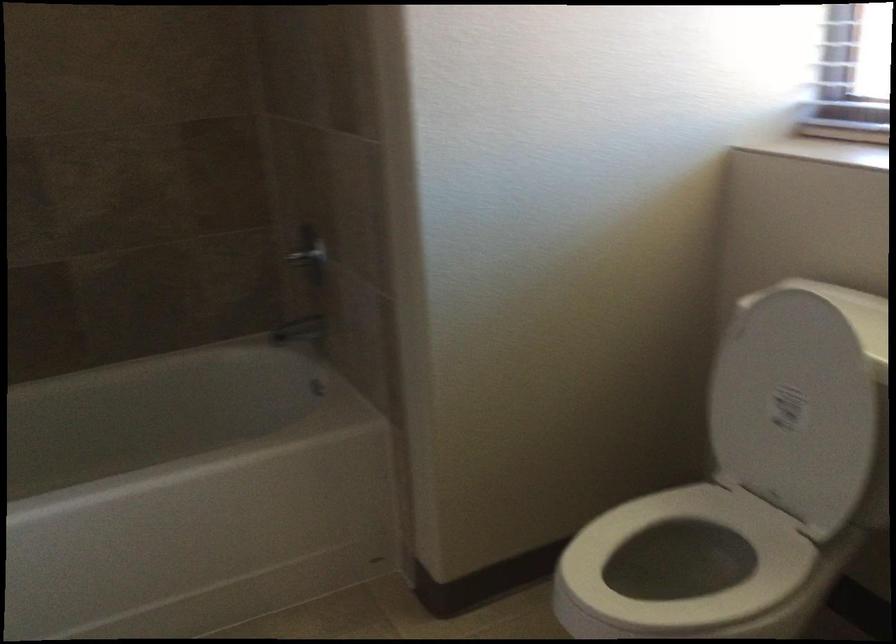
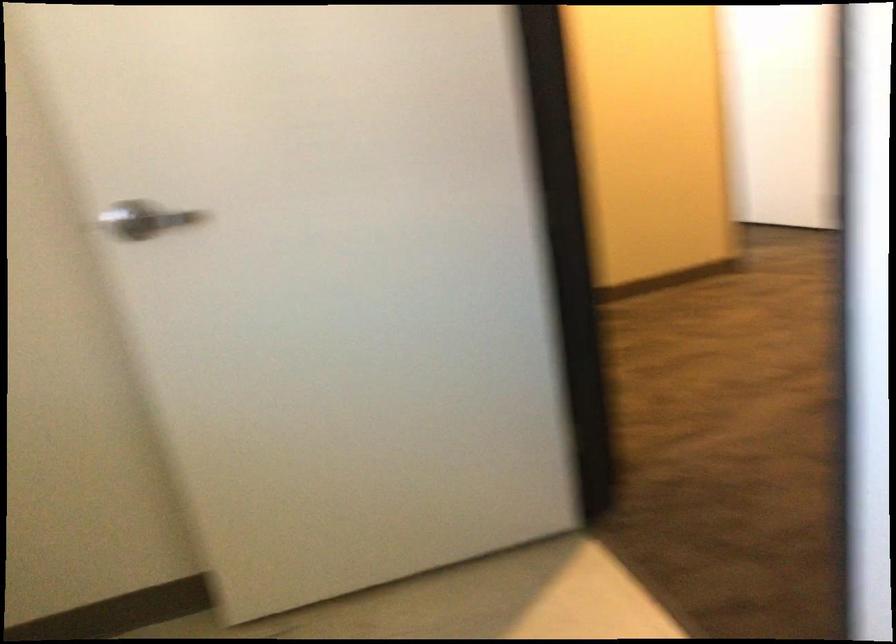
Question: What movement of the cameraman would produce the second image?

Choices:
 (A) Left
 (B) Right
 (C) Forward
 (D) Backward

Answer: (D)